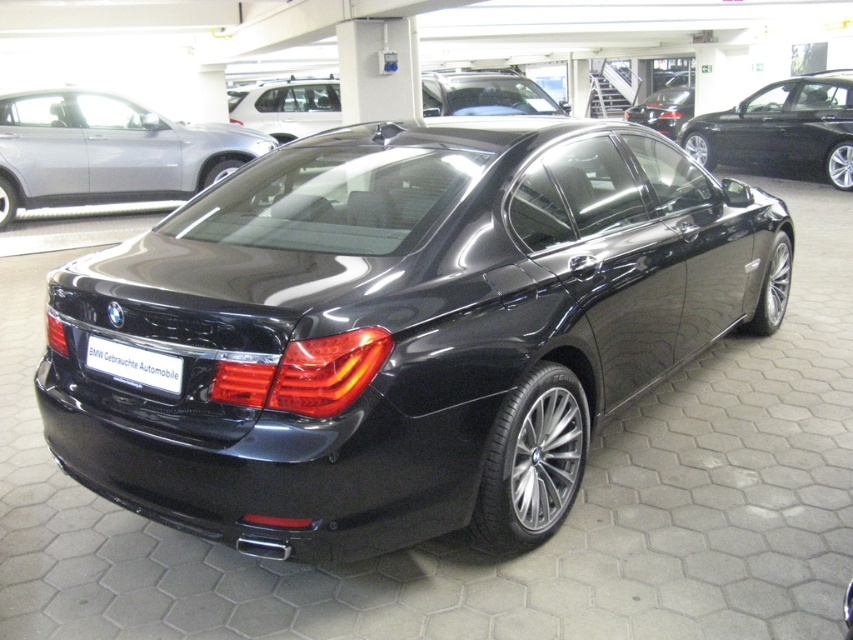
Does glossy black sedan at upper left have a greater height compared to glossy black sedan at upper right?

No, glossy black sedan at upper left is not taller than glossy black sedan at upper right.

Between glossy black sedan at upper left and glossy black sedan at upper right, which one appears on the right side from the viewer's perspective?

From the viewer's perspective, glossy black sedan at upper right appears more on the right side.

Locate an element on the screen. The height and width of the screenshot is (640, 853). glossy black sedan at upper left is located at coordinates (107, 150).

Which is in front, point (642, 288) or point (709, 166)?

Point (642, 288)

Can you confirm if glossy black car at center is positioned to the left of glossy black sedan at upper right?

Correct, you'll find glossy black car at center to the left of glossy black sedan at upper right.

The width and height of the screenshot is (853, 640). What are the coordinates of `glossy black car at center` in the screenshot? It's located at (398, 326).

Is glossy black car at center positioned behind glossy black sedan at center?

No, glossy black car at center is closer to the viewer.

Does glossy black car at center have a lesser height compared to glossy black sedan at center?

Yes.

Locate an element on the screen. This screenshot has width=853, height=640. glossy black car at center is located at coordinates (398, 326).

The width and height of the screenshot is (853, 640). What are the coordinates of `glossy black car at center` in the screenshot? It's located at (398, 326).